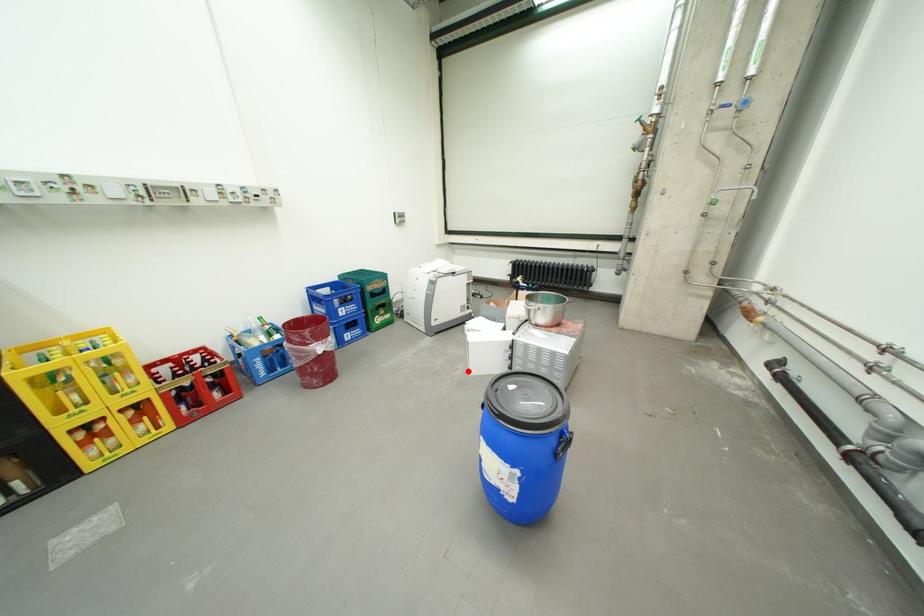
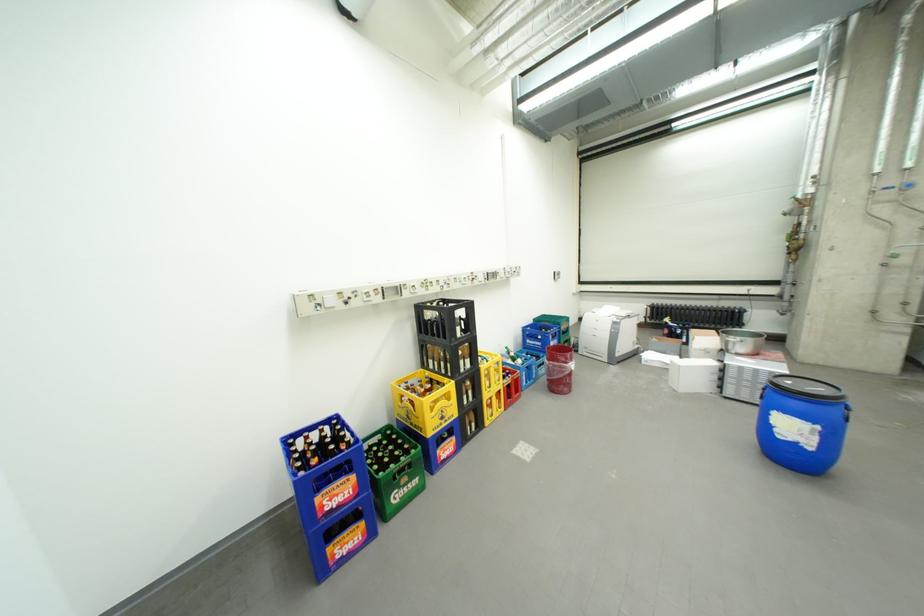
Question: I am providing you with two images of the same scene from different viewpoints. Given a red point in image1, look at the same physical point in image2. Is it:

Choices:
 (A) Closer to the viewpoint
 (B) Farther from the viewpoint

Answer: (A)